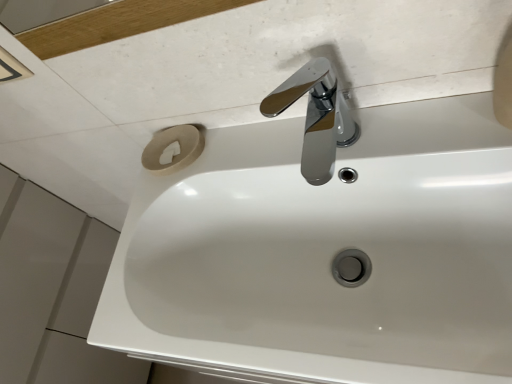
Question: From the image's perspective, is white glossy sink at center under chrome/metallic faucet at upper center?

Choices:
 (A) yes
 (B) no

Answer: (A)

Question: Is the position of white glossy sink at center less distant than that of chrome/metallic faucet at upper center?

Choices:
 (A) no
 (B) yes

Answer: (B)

Question: Can we say white glossy sink at center lies outside chrome/metallic faucet at upper center?

Choices:
 (A) no
 (B) yes

Answer: (B)

Question: Is white glossy sink at center touching chrome/metallic faucet at upper center?

Choices:
 (A) yes
 (B) no

Answer: (B)

Question: Is white glossy sink at center wider than chrome/metallic faucet at upper center?

Choices:
 (A) no
 (B) yes

Answer: (B)

Question: From a real-world perspective, is white glossy sink at center positioned over chrome/metallic faucet at upper center based on gravity?

Choices:
 (A) yes
 (B) no

Answer: (B)

Question: Can you confirm if chrome/metallic faucet at upper center is bigger than white glossy sink at center?

Choices:
 (A) no
 (B) yes

Answer: (A)

Question: Can you confirm if chrome/metallic faucet at upper center is smaller than white glossy sink at center?

Choices:
 (A) yes
 (B) no

Answer: (A)

Question: Is there a large distance between chrome/metallic faucet at upper center and white glossy sink at center?

Choices:
 (A) no
 (B) yes

Answer: (A)

Question: Is chrome/metallic faucet at upper center to the left of white glossy sink at center from the viewer's perspective?

Choices:
 (A) no
 (B) yes

Answer: (A)

Question: Is chrome/metallic faucet at upper center further to camera compared to white glossy sink at center?

Choices:
 (A) yes
 (B) no

Answer: (A)

Question: From a real-world perspective, is chrome/metallic faucet at upper center over white glossy sink at center?

Choices:
 (A) yes
 (B) no

Answer: (A)

Question: From a real-world perspective, is chrome/metallic faucet at upper center above or below white glossy sink at center?

Choices:
 (A) below
 (B) above

Answer: (B)